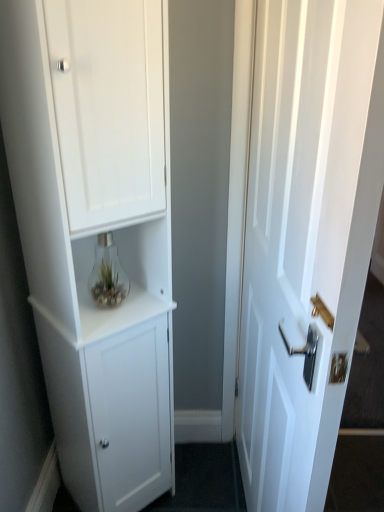
Question: Is white matte cabinet at left oriented towards white glossy door at right?

Choices:
 (A) yes
 (B) no

Answer: (A)

Question: Does white matte cabinet at left have a lesser height compared to white glossy door at right?

Choices:
 (A) yes
 (B) no

Answer: (B)

Question: Is white matte cabinet at left positioned in front of white glossy door at right?

Choices:
 (A) no
 (B) yes

Answer: (A)

Question: From a real-world perspective, is white matte cabinet at left on top of white glossy door at right?

Choices:
 (A) no
 (B) yes

Answer: (B)

Question: Is white matte cabinet at left positioned beyond the bounds of white glossy door at right?

Choices:
 (A) no
 (B) yes

Answer: (B)

Question: Is white matte cabinet at left bigger than white glossy door at right?

Choices:
 (A) yes
 (B) no

Answer: (A)

Question: Is white glossy door at right closer to the viewer compared to white matte cabinet at left?

Choices:
 (A) no
 (B) yes

Answer: (B)

Question: From the image's perspective, is white glossy door at right located above white matte cabinet at left?

Choices:
 (A) yes
 (B) no

Answer: (B)

Question: Can you confirm if white glossy door at right is taller than white matte cabinet at left?

Choices:
 (A) no
 (B) yes

Answer: (A)

Question: Could white matte cabinet at left be considered to be inside white glossy door at right?

Choices:
 (A) no
 (B) yes

Answer: (A)

Question: Is the position of white glossy door at right more distant than that of white matte cabinet at left?

Choices:
 (A) no
 (B) yes

Answer: (A)

Question: Considering the relative sizes of white glossy door at right and white matte cabinet at left in the image provided, is white glossy door at right thinner than white matte cabinet at left?

Choices:
 (A) no
 (B) yes

Answer: (B)

Question: Is point (120, 200) closer or farther from the camera than point (367, 181)?

Choices:
 (A) closer
 (B) farther

Answer: (B)